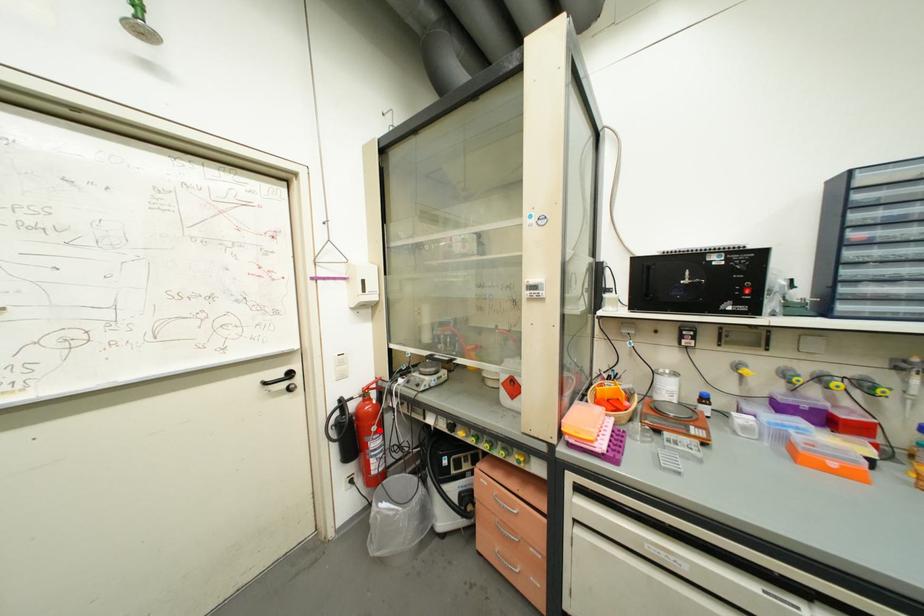
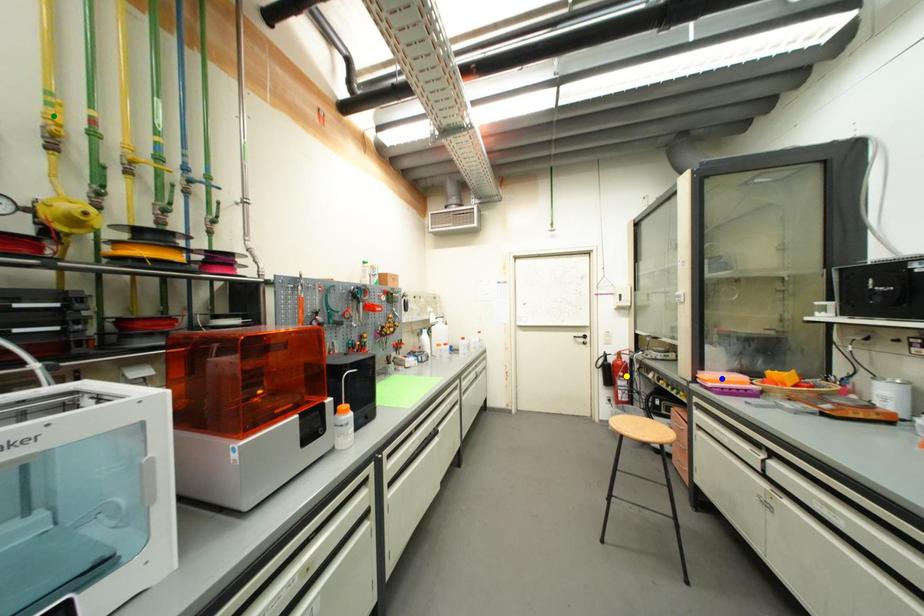
Question: I am providing you with two images of the same scene from different viewpoints. A red point is marked on the first image. You are given multiple points on the second image. Which point in image 2 is actually the same real-world point as the red point in image 1?

Choices:
 (A) yellow point
 (B) blue point
 (C) green point

Answer: (A)